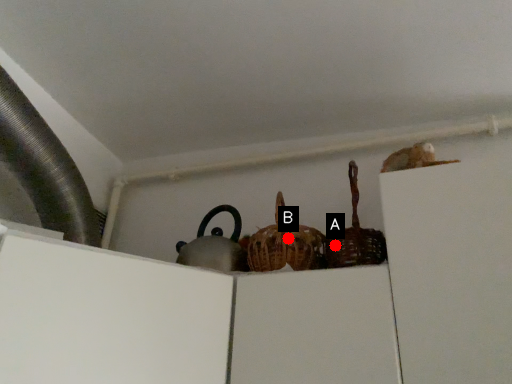
Question: Two points are circled on the image, labeled by A and B beside each circle. Which point is closer to the camera taking this photo?

Choices:
 (A) A is closer
 (B) B is closer

Answer: (A)